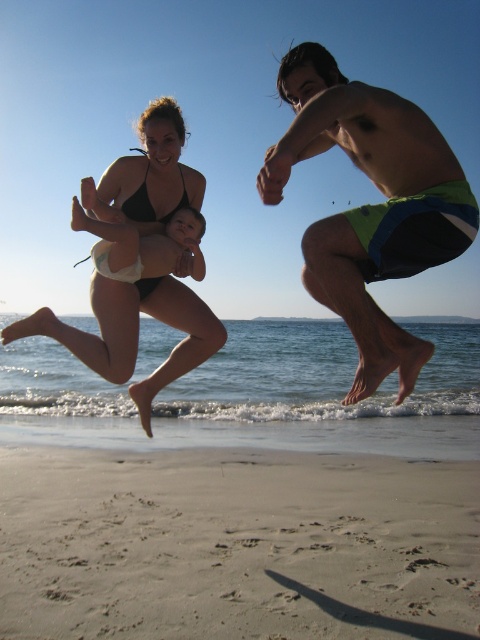
Which of these two, light beige sand at lower center or black matte bikini at upper left, stands taller?

black matte bikini at upper left is taller.

In the scene shown: Who is higher up, light beige sand at lower center or black matte bikini at upper left?

black matte bikini at upper left is above.

Based on the photo, who is more forward, (109,522) or (86,205)?

Point (86,205) is more forward.

The image size is (480, 640). In order to click on light beige sand at lower center in this screenshot , I will do `click(240, 529)`.

Which is in front, point (382, 173) or point (184, 205)?

Point (382, 173)

Which is below, green and blue swim trunks at right or black matte bikini top at center?

green and blue swim trunks at right is lower down.

Who is more distant from viewer, [273,176] or [143,180]?

Positioned behind is point [143,180].

The height and width of the screenshot is (640, 480). I want to click on green and blue swim trunks at right, so click(370, 205).

Can you confirm if black matte bikini at upper left is taller than black matte bikini at upper center?

Correct, black matte bikini at upper left is much taller as black matte bikini at upper center.

Can you confirm if black matte bikini at upper left is bigger than black matte bikini at upper center?

Indeed, black matte bikini at upper left has a larger size compared to black matte bikini at upper center.

Image resolution: width=480 pixels, height=640 pixels. I want to click on black matte bikini at upper left, so click(144, 264).